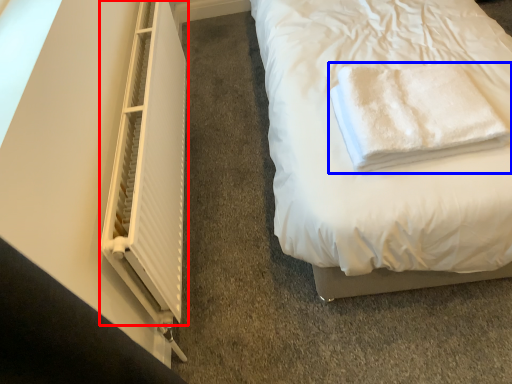
Question: Which point is closer to the camera, window (highlighted by a red box) or towel (highlighted by a blue box)?

Choices:
 (A) window
 (B) towel

Answer: (A)